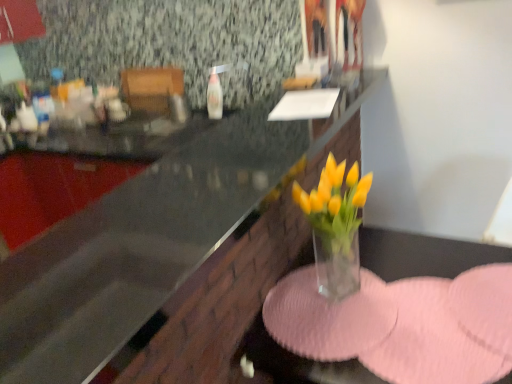
Question: Can you confirm if transparent glass vase at center is smaller than transparent glass countertop at center?

Choices:
 (A) yes
 (B) no

Answer: (B)

Question: Is the depth of transparent glass vase at center less than that of transparent glass countertop at center?

Choices:
 (A) no
 (B) yes

Answer: (A)

Question: From the image's perspective, would you say transparent glass vase at center is positioned over transparent glass countertop at center?

Choices:
 (A) no
 (B) yes

Answer: (A)

Question: Does transparent glass vase at center have a greater width compared to transparent glass countertop at center?

Choices:
 (A) no
 (B) yes

Answer: (A)

Question: Is there a large distance between transparent glass vase at center and transparent glass countertop at center?

Choices:
 (A) no
 (B) yes

Answer: (A)

Question: Is transparent glass vase at center surrounding transparent glass countertop at center?

Choices:
 (A) no
 (B) yes

Answer: (A)

Question: From a real-world perspective, is transparent glass countertop at center on top of transparent glass vase at center?

Choices:
 (A) no
 (B) yes

Answer: (B)

Question: Does transparent glass countertop at center appear on the right side of transparent glass vase at center?

Choices:
 (A) yes
 (B) no

Answer: (B)

Question: Does transparent glass countertop at center have a smaller size compared to transparent glass vase at center?

Choices:
 (A) no
 (B) yes

Answer: (B)

Question: Does transparent glass countertop at center have a lesser height compared to transparent glass vase at center?

Choices:
 (A) yes
 (B) no

Answer: (A)

Question: Is transparent glass vase at center inside transparent glass countertop at center?

Choices:
 (A) yes
 (B) no

Answer: (B)

Question: Considering the relative positions of transparent glass countertop at center and transparent glass vase at center in the image provided, is transparent glass countertop at center in front of transparent glass vase at center?

Choices:
 (A) no
 (B) yes

Answer: (B)

Question: In the image, is transparent glass vase at center positioned in front of or behind transparent glass countertop at center?

Choices:
 (A) behind
 (B) front

Answer: (A)